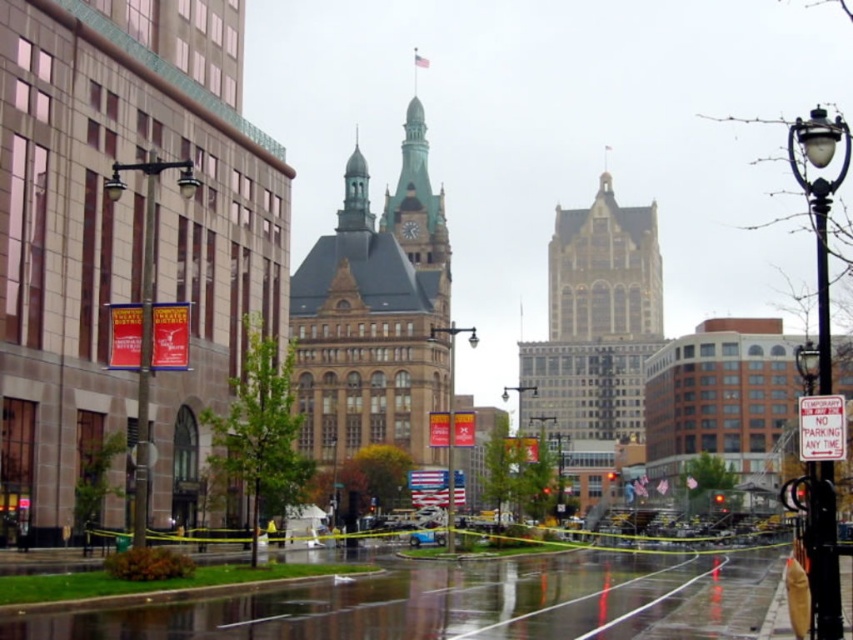
You are a city planner assessing the street layout. You need to install a new wider streetlight between the black metal streetlight at right and the black glass streetlight at center. Which existing streetlight should you use as a reference for the minimum width requirement?

The black metal streetlight at right has a greater width than the black glass streetlight at center. To ensure the new wider streetlight meets the minimum width requirement, you should use the black metal streetlight at right as the reference since it is wider.

You are a tourist holding a map and standing at the intersection of the street. You see the brown stone clock tower at center and the black metal streetlight at right. Which object is closer to you?

The brown stone clock tower at center is closer to you because it is further to the viewer than the black metal streetlight at right.

You are a window cleaner who needs to clean both the black metal streetlight at right and the black glass streetlight at center. Which one do you need to climb higher to reach the top?

The black metal streetlight at right has a greater height compared to the black glass streetlight at center, so you need to climb higher to reach the top of the black metal streetlight at right.